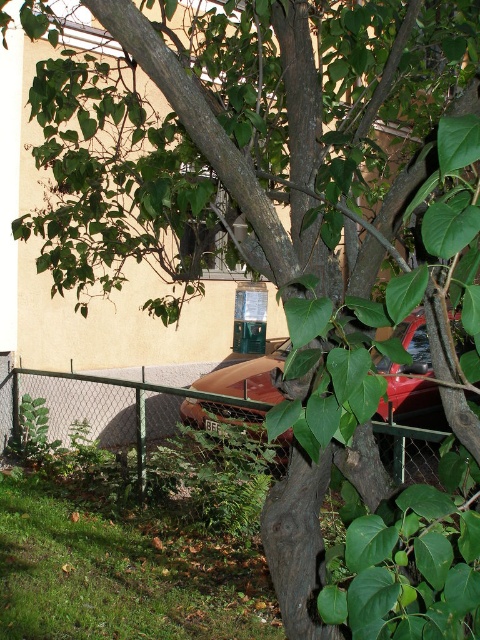
Question: Is green chain-link fence at lower center closer to camera compared to rusty metal car at center?

Choices:
 (A) yes
 (B) no

Answer: (B)

Question: Is green chain-link fence at lower center bigger than rusty metal car at center?

Choices:
 (A) yes
 (B) no

Answer: (A)

Question: Is the position of green chain-link fence at lower center more distant than that of rusty metal car at center?

Choices:
 (A) no
 (B) yes

Answer: (B)

Question: Which object appears farthest from the camera in this image?

Choices:
 (A) rusty metal car at center
 (B) green chain-link fence at lower center

Answer: (B)